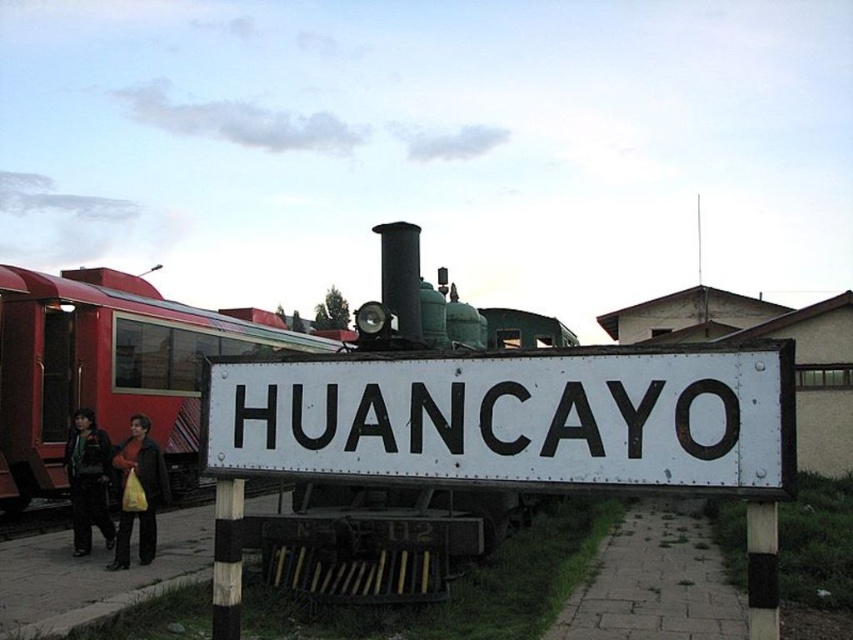
Is white metal signboard at center below red painted metal train car at left?

Actually, white metal signboard at center is above red painted metal train car at left.

Looking at this image, does white metal signboard at center appear over red painted metal train car at left?

Indeed, white metal signboard at center is positioned over red painted metal train car at left.

Is point (376, 356) closer to viewer compared to point (177, 324)?

Yes, point (376, 356) is closer to viewer.

At what (x,y) coordinates should I click in order to perform the action: click on white metal signboard at center. Please return your answer as a coordinate pair (x, y). Looking at the image, I should click on (512, 419).

Which is above, white metal signboard at center or dark green jacket at left?

white metal signboard at center

Is white metal signboard at center further to the viewer compared to dark green jacket at left?

No, it is not.

Measure the distance between point (473, 403) and camera.

Point (473, 403) and camera are 12.03 feet apart.

The width and height of the screenshot is (853, 640). In order to click on white metal signboard at center in this screenshot , I will do `click(512, 419)`.

Between red painted metal train car at left and yellow plastic bag at lower left, which one has less height?

With less height is yellow plastic bag at lower left.

The width and height of the screenshot is (853, 640). I want to click on red painted metal train car at left, so click(x=106, y=369).